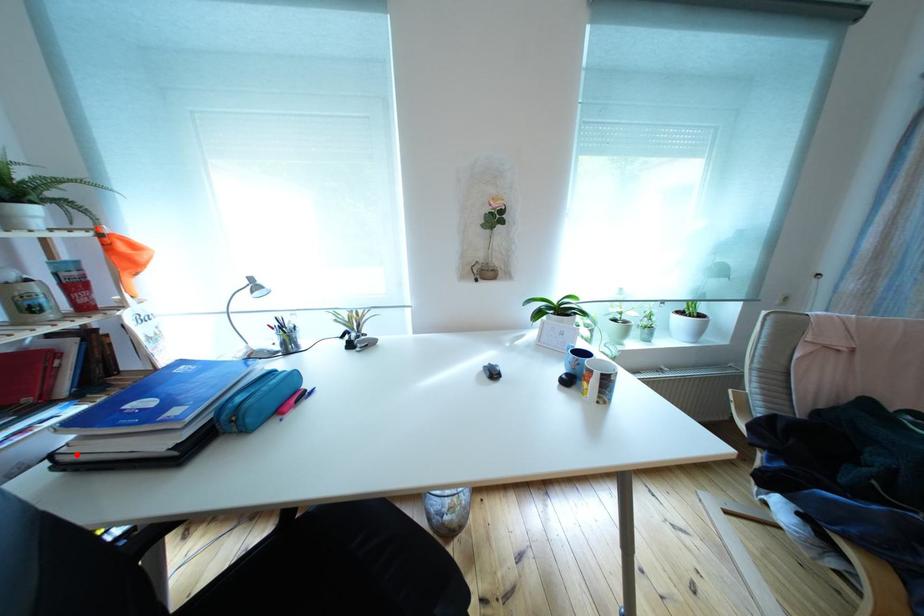
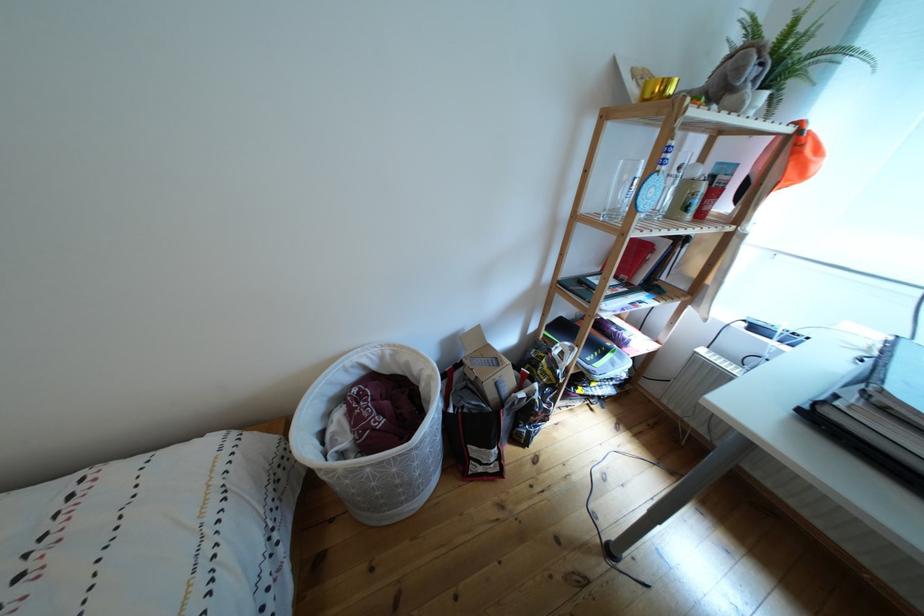
The point at the highlighted location is marked in the first image. Where is the corresponding point in the second image?

(849, 408)